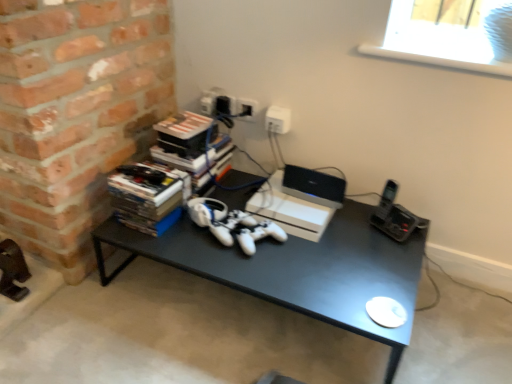
Question: Is the position of white plastic laptop at center less distant than that of white plastic window screen at upper right?

Choices:
 (A) no
 (B) yes

Answer: (A)

Question: Could you tell me if white plastic laptop at center is facing white plastic window screen at upper right?

Choices:
 (A) no
 (B) yes

Answer: (A)

Question: From the image's perspective, is white plastic laptop at center over white plastic window screen at upper right?

Choices:
 (A) yes
 (B) no

Answer: (B)

Question: Would you say white plastic laptop at center is a long distance from white plastic window screen at upper right?

Choices:
 (A) no
 (B) yes

Answer: (A)

Question: Does white plastic laptop at center have a lesser width compared to white plastic window screen at upper right?

Choices:
 (A) no
 (B) yes

Answer: (B)

Question: From a real-world perspective, is white plastic laptop at center located higher than white plastic window screen at upper right?

Choices:
 (A) no
 (B) yes

Answer: (A)

Question: From the image's perspective, is white plastic window screen at upper right above white plastic electric outlet at upper center?

Choices:
 (A) yes
 (B) no

Answer: (A)

Question: Can you confirm if white plastic window screen at upper right is bigger than white plastic electric outlet at upper center?

Choices:
 (A) no
 (B) yes

Answer: (B)

Question: Is white plastic window screen at upper right thinner than white plastic electric outlet at upper center?

Choices:
 (A) no
 (B) yes

Answer: (A)

Question: From a real-world perspective, is white plastic window screen at upper right located beneath white plastic electric outlet at upper center?

Choices:
 (A) yes
 (B) no

Answer: (B)

Question: Can you confirm if white plastic window screen at upper right is taller than white plastic electric outlet at upper center?

Choices:
 (A) no
 (B) yes

Answer: (A)

Question: Considering the relative positions of white plastic window screen at upper right and white plastic electric outlet at upper center in the image provided, is white plastic window screen at upper right behind white plastic electric outlet at upper center?

Choices:
 (A) yes
 (B) no

Answer: (B)

Question: Is white plastic window screen at upper right further to the viewer compared to white matte gaming console at center?

Choices:
 (A) yes
 (B) no

Answer: (B)